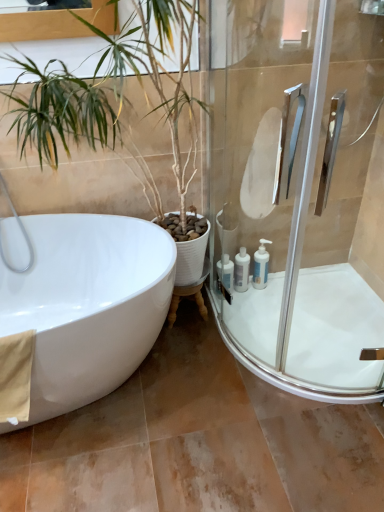
Identify the location of free location in front of clear glass shower door at right. (242, 414).